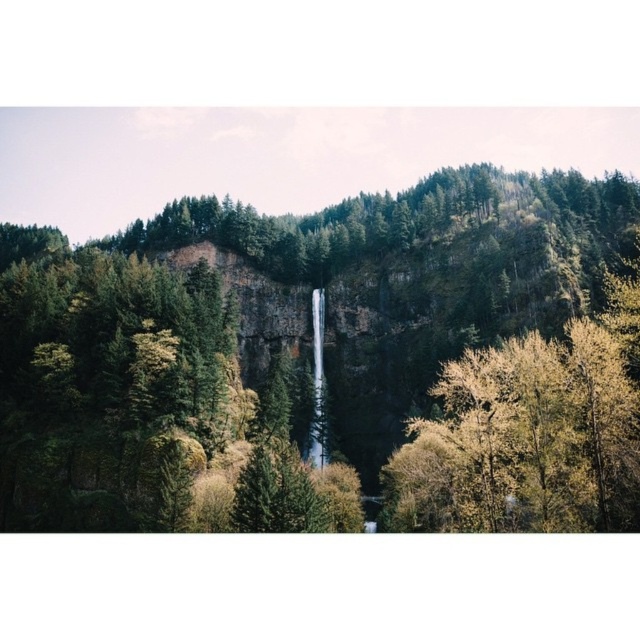
Is green matte forest at center closer to the viewer compared to transparent glass waterfall at center?

Result: Yes.

Which is below, green matte forest at center or transparent glass waterfall at center?

transparent glass waterfall at center is lower down.

Between point (611, 294) and point (323, 465), which one is positioned in front?

Point (611, 294)

You are a GUI agent. You are given a task and a screenshot of the screen. Output one action in this format:
    pyautogui.click(x=<x>, y=<y>)
    Task: Click on the green matte forest at center
    Image resolution: width=640 pixels, height=640 pixels.
    Given the screenshot: What is the action you would take?
    pyautogui.click(x=337, y=362)